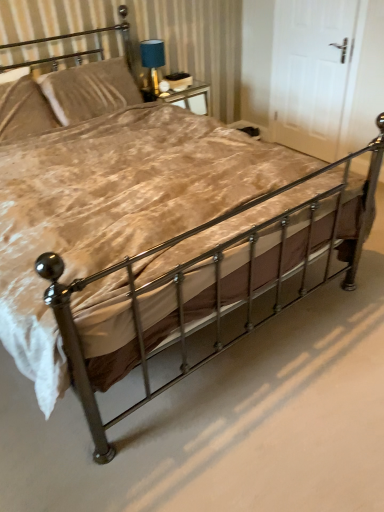
Find the location of `velvet beige pillow at upper left, marked as the first pillow in a left-to-right arrangement`. velvet beige pillow at upper left, marked as the first pillow in a left-to-right arrangement is located at coordinates (24, 110).

Describe the element at coordinates (79, 71) in the screenshot. Image resolution: width=384 pixels, height=512 pixels. I see `metallic gold headboard at upper left` at that location.

The height and width of the screenshot is (512, 384). Describe the element at coordinates (153, 62) in the screenshot. I see `blue fabric lampshade at upper center` at that location.

At what (x,y) coordinates should I click in order to perform the action: click on velvet beige pillow at upper left, marked as the first pillow in a left-to-right arrangement. Please return your answer as a coordinate pair (x, y). The height and width of the screenshot is (512, 384). Looking at the image, I should click on (24, 110).

From a real-world perspective, is velvet beige pillow at upper left, marked as the 2th pillow in a right-to-left arrangement, on polished metal bed frame at center?

Yes, from a real-world perspective, velvet beige pillow at upper left, marked as the 2th pillow in a right-to-left arrangement, is on top of polished metal bed frame at center.

Considering the sizes of objects velvet beige pillow at upper left, marked as the 2th pillow in a right-to-left arrangement, and polished metal bed frame at center in the image provided, who is smaller, velvet beige pillow at upper left, marked as the 2th pillow in a right-to-left arrangement, or polished metal bed frame at center?

velvet beige pillow at upper left, marked as the 2th pillow in a right-to-left arrangement, is smaller.

Does velvet beige pillow at upper left, marked as the first pillow in a left-to-right arrangement, turn towards polished metal bed frame at center?

No, velvet beige pillow at upper left, marked as the first pillow in a left-to-right arrangement, is not turned towards polished metal bed frame at center.

Is velvet beige pillow at upper left, marked as the 2th pillow in a right-to-left arrangement, next to polished metal bed frame at center?

No.

Does velvet-like beige pillow at upper left, acting as the first pillow starting from the right, appear on the left side of polished metal bed frame at center?

Indeed, velvet-like beige pillow at upper left, acting as the first pillow starting from the right, is positioned on the left side of polished metal bed frame at center.

Can you confirm if velvet-like beige pillow at upper left, the second pillow from the left, is wider than polished metal bed frame at center?

No, velvet-like beige pillow at upper left, the second pillow from the left, is not wider than polished metal bed frame at center.

From the image's perspective, would you say velvet-like beige pillow at upper left, the second pillow from the left, is shown under polished metal bed frame at center?

Actually, velvet-like beige pillow at upper left, the second pillow from the left, appears above polished metal bed frame at center in the image.

Is blue fabric lampshade at upper center inside the boundaries of white matte door at upper right, or outside?

blue fabric lampshade at upper center is not enclosed by white matte door at upper right.

Based on the photo, considering the positions of objects blue fabric lampshade at upper center and white matte door at upper right in the image provided, who is more to the left, blue fabric lampshade at upper center or white matte door at upper right?

Positioned to the left is blue fabric lampshade at upper center.

What's the angular difference between blue fabric lampshade at upper center and white matte door at upper right's facing directions?

blue fabric lampshade at upper center and white matte door at upper right are facing 89.7 degrees away from each other.

Does blue fabric lampshade at upper center have a lesser height compared to white matte door at upper right?

Correct, blue fabric lampshade at upper center is not as tall as white matte door at upper right.

Which object is more forward, polished metal bed frame at center or blue fabric lampshade at upper center?

polished metal bed frame at center.

Are polished metal bed frame at center and blue fabric lampshade at upper center making contact?

polished metal bed frame at center and blue fabric lampshade at upper center are not in contact.

What's the angular difference between polished metal bed frame at center and blue fabric lampshade at upper center's facing directions?

There is a 0.15-degree angle between the facing directions of polished metal bed frame at center and blue fabric lampshade at upper center.

Based on the photo, from a real-world perspective, between polished metal bed frame at center and blue fabric lampshade at upper center, who is vertically lower?

From a 3D spatial view, polished metal bed frame at center is below.

From a real-world perspective, does white matte door at upper right stand above velvet-like beige pillow at upper left, the second pillow from the left?

No, from a real-world perspective, white matte door at upper right is not over velvet-like beige pillow at upper left, the second pillow from the left

Between point (276, 22) and point (102, 68), which one is positioned in front?

The point (102, 68) is closer to the camera.

Is white matte door at upper right not near velvet-like beige pillow at upper left, acting as the first pillow starting from the right?

Absolutely, white matte door at upper right is distant from velvet-like beige pillow at upper left, acting as the first pillow starting from the right.

From the image's perspective, does white matte door at upper right appear lower than velvet-like beige pillow at upper left, acting as the first pillow starting from the right?

No, from the image's perspective, white matte door at upper right is not below velvet-like beige pillow at upper left, acting as the first pillow starting from the right.

Which of these two, velvet-like beige pillow at upper left, the second pillow from the left, or metallic gold headboard at upper left, is thinner?

velvet-like beige pillow at upper left, the second pillow from the left.

Does velvet-like beige pillow at upper left, the second pillow from the left, appear on the right side of metallic gold headboard at upper left?

Incorrect, velvet-like beige pillow at upper left, the second pillow from the left, is not on the right side of metallic gold headboard at upper left.

Are velvet-like beige pillow at upper left, acting as the first pillow starting from the right, and metallic gold headboard at upper left beside each other?

Yes, velvet-like beige pillow at upper left, acting as the first pillow starting from the right, is next to metallic gold headboard at upper left.

Is velvet-like beige pillow at upper left, acting as the first pillow starting from the right, positioned with its back to metallic gold headboard at upper left?

Absolutely, velvet-like beige pillow at upper left, acting as the first pillow starting from the right, is directed away from metallic gold headboard at upper left.

Is velvet beige pillow at upper left, marked as the 2th pillow in a right-to-left arrangement, located outside white matte door at upper right?

That's correct, velvet beige pillow at upper left, marked as the 2th pillow in a right-to-left arrangement, is outside of white matte door at upper right.

At what (x,y) coordinates should I click in order to perform the action: click on door directly beneath the velvet beige pillow at upper left, marked as the 2th pillow in a right-to-left arrangement (from a real-world perspective). Please return your answer as a coordinate pair (x, y). The width and height of the screenshot is (384, 512). Looking at the image, I should click on (311, 73).

Measure the distance between velvet beige pillow at upper left, marked as the 2th pillow in a right-to-left arrangement, and white matte door at upper right.

They are 6.57 feet apart.

You are a GUI agent. You are given a task and a screenshot of the screen. Output one action in this format:
    pyautogui.click(x=<x>, y=<y>)
    Task: Click on the pillow that is the 2nd one when counting leftward from the polished metal bed frame at center
    
    Given the screenshot: What is the action you would take?
    pyautogui.click(x=24, y=110)

From the image's perspective, count 2nd pillows upward from the polished metal bed frame at center and point to it. Please provide its 2D coordinates.

[(90, 90)]

Based on their spatial positions, is velvet-like beige pillow at upper left, the second pillow from the left, or blue fabric lampshade at upper center closer to metallic gold headboard at upper left?

Based on the image, velvet-like beige pillow at upper left, the second pillow from the left, appears to be nearer to metallic gold headboard at upper left.

When comparing their distances from velvet beige pillow at upper left, marked as the 2th pillow in a right-to-left arrangement, does polished metal bed frame at center or white matte door at upper right seem closer?

polished metal bed frame at center is closer to velvet beige pillow at upper left, marked as the 2th pillow in a right-to-left arrangement.

When comparing their distances from velvet-like beige pillow at upper left, the second pillow from the left, does metallic gold headboard at upper left or white matte door at upper right seem further?

Among the two, white matte door at upper right is located further to velvet-like beige pillow at upper left, the second pillow from the left.

Looking at the image, which one is located further to velvet-like beige pillow at upper left, the second pillow from the left, blue fabric lampshade at upper center or white matte door at upper right?

Based on the image, white matte door at upper right appears to be further to velvet-like beige pillow at upper left, the second pillow from the left.

From the image, which object appears to be nearer to blue fabric lampshade at upper center, velvet-like beige pillow at upper left, the second pillow from the left, or velvet beige pillow at upper left, marked as the first pillow in a left-to-right arrangement?

velvet-like beige pillow at upper left, the second pillow from the left, is positioned closer to the anchor blue fabric lampshade at upper center.

Looking at the image, which one is located closer to blue fabric lampshade at upper center, white matte door at upper right or velvet-like beige pillow at upper left, the second pillow from the left?

Among the two, velvet-like beige pillow at upper left, the second pillow from the left, is located nearer to blue fabric lampshade at upper center.

Looking at the image, which one is located closer to velvet beige pillow at upper left, marked as the 2th pillow in a right-to-left arrangement, white matte door at upper right or velvet-like beige pillow at upper left, acting as the first pillow starting from the right?

velvet-like beige pillow at upper left, acting as the first pillow starting from the right.

Considering their positions, is velvet-like beige pillow at upper left, acting as the first pillow starting from the right, positioned further to metallic gold headboard at upper left than white matte door at upper right?

white matte door at upper right lies further to metallic gold headboard at upper left than the other object.

The height and width of the screenshot is (512, 384). Find the location of `headboard between velvet beige pillow at upper left, marked as the 2th pillow in a right-to-left arrangement, and white matte door at upper right from left to right`. headboard between velvet beige pillow at upper left, marked as the 2th pillow in a right-to-left arrangement, and white matte door at upper right from left to right is located at coordinates (79, 71).

I want to click on pillow between polished metal bed frame at center and metallic gold headboard at upper left from front to back, so coord(24,110).

Where is `table lamp between velvet beige pillow at upper left, marked as the first pillow in a left-to-right arrangement, and white matte door at upper right, in the horizontal direction`? This screenshot has width=384, height=512. table lamp between velvet beige pillow at upper left, marked as the first pillow in a left-to-right arrangement, and white matte door at upper right, in the horizontal direction is located at coordinates (153, 62).

Identify the location of headboard situated between velvet beige pillow at upper left, marked as the first pillow in a left-to-right arrangement, and blue fabric lampshade at upper center from left to right. Image resolution: width=384 pixels, height=512 pixels. (79, 71).